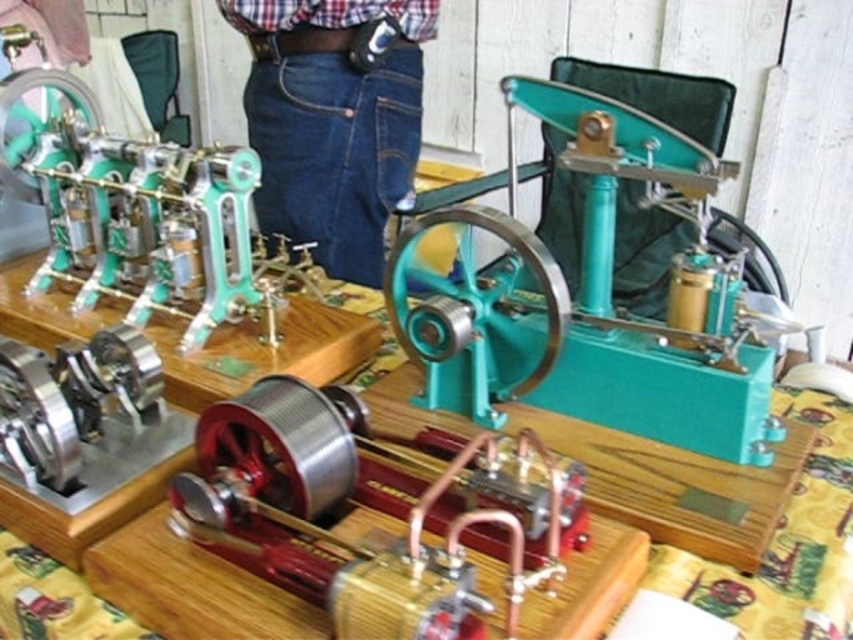
Measure the distance between denim jeans at center and plaid cotton shirt at upper center.

4.83 inches

Can you confirm if denim jeans at center is positioned below plaid cotton shirt at upper center?

Correct, denim jeans at center is located below plaid cotton shirt at upper center.

Is point (395, 129) positioned in front of point (410, 4)?

No.

Where is `denim jeans at center`? denim jeans at center is located at coordinates (334, 120).